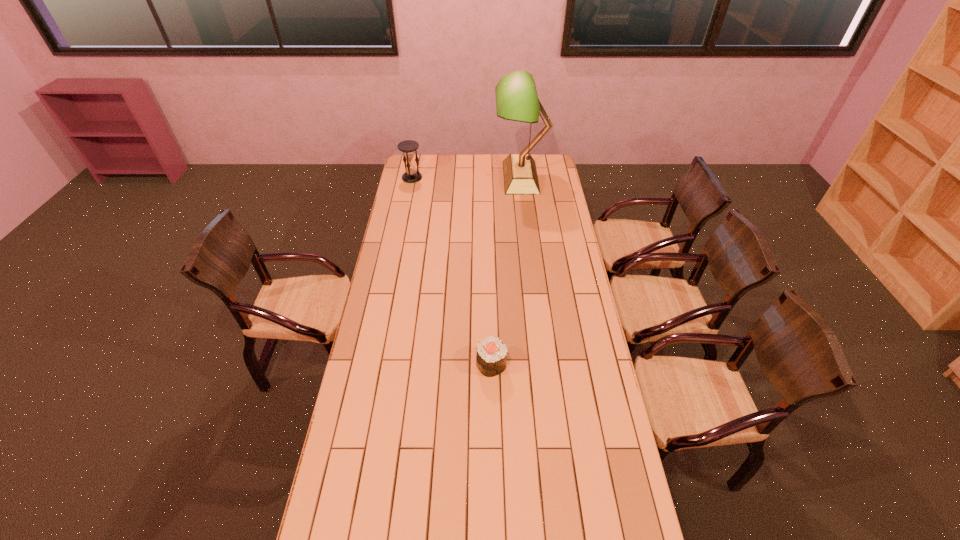
I want to click on table lamp located in the far edge section of the desktop, so click(516, 97).

I want to click on hourglass that is at the far edge, so click(x=409, y=147).

The height and width of the screenshot is (540, 960). I want to click on object that is at the left edge, so click(409, 147).

At what (x,y) coordinates should I click in order to perform the action: click on object that is at the right edge. Please return your answer as a coordinate pair (x, y). The image size is (960, 540). Looking at the image, I should click on (516, 97).

Identify the location of object at the far left corner. (409, 147).

In order to click on object located in the far right corner section of the desktop in this screenshot , I will do `click(516, 97)`.

Where is `free location at the far edge of the desktop`? Image resolution: width=960 pixels, height=540 pixels. free location at the far edge of the desktop is located at coordinates (452, 160).

In the image, there is a desktop. Where is `free space at the left edge`? free space at the left edge is located at coordinates (402, 288).

Where is `vacant space at the right edge`? This screenshot has height=540, width=960. vacant space at the right edge is located at coordinates (586, 518).

Image resolution: width=960 pixels, height=540 pixels. What are the coordinates of `vacant region between the sushi and the tallest object` in the screenshot? It's located at (506, 271).